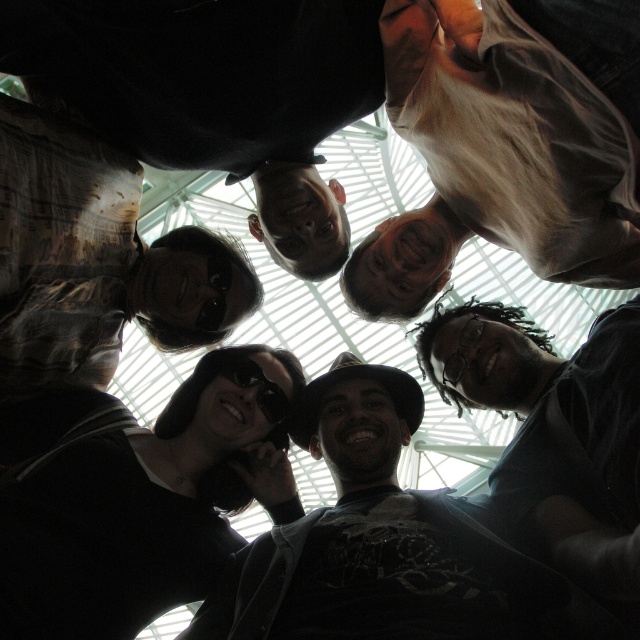
You are standing in the middle of a group photo setup. You notice two people in the group photo setup. The light brown shirt at upper right and the matte black shirt at center. Which one is closer to the camera?

The light brown shirt at upper right is in front of the matte black shirt at center, so it is closer to the camera.

You are standing in a group photo where you can see the light brown shirt at upper right and the dark gray shirt at center. Which shirt is positioned higher in the image?

The light brown shirt at upper right is positioned higher than the dark gray shirt at center.

You are a photographer standing 10 meters away from the group. You want to take a photo that includes both the matte black shirt at center and the dark gray shirt at center. Given the distance between them, will you need to zoom in or zoom out to ensure both are fully visible in the frame?

The distance between the matte black shirt at center and the dark gray shirt at center is 16.61 meters. Since you are 10 meters away from the group, the subjects are farther apart than your distance from them. To capture both in the frame, you would need to zoom out to widen the field of view.